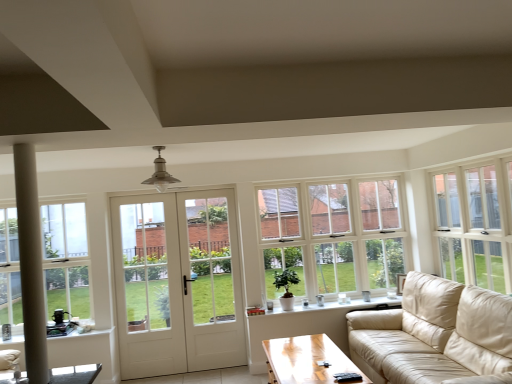
Question: Is beige leather couch at right at the left side of white glass door at center?

Choices:
 (A) yes
 (B) no

Answer: (B)

Question: Considering the relative positions of beige leather couch at right and white glass door at center in the image provided, is beige leather couch at right to the right of white glass door at center from the viewer's perspective?

Choices:
 (A) yes
 (B) no

Answer: (A)

Question: From the image's perspective, is beige leather couch at right under white glass door at center?

Choices:
 (A) no
 (B) yes

Answer: (B)

Question: Can you confirm if beige leather couch at right is taller than white glass door at center?

Choices:
 (A) yes
 (B) no

Answer: (B)

Question: Could white glass door at center be considered to be inside beige leather couch at right?

Choices:
 (A) no
 (B) yes

Answer: (A)

Question: Are beige leather couch at right and white glass door at center making contact?

Choices:
 (A) yes
 (B) no

Answer: (B)

Question: Could you tell me if clear glass window at left, marked as the first window in a left-to-right arrangement, is facing white wooden door at center?

Choices:
 (A) no
 (B) yes

Answer: (A)

Question: Is clear glass window at left, which is the 2th window from front to back, positioned in front of white wooden door at center?

Choices:
 (A) yes
 (B) no

Answer: (A)

Question: Considering the relative sizes of clear glass window at left, which is the 2th window from front to back, and white wooden door at center in the image provided, is clear glass window at left, which is the 2th window from front to back, taller than white wooden door at center?

Choices:
 (A) yes
 (B) no

Answer: (B)

Question: From the image's perspective, is clear glass window at left, which is the 2th window from front to back, over white wooden door at center?

Choices:
 (A) yes
 (B) no

Answer: (A)

Question: Considering the relative sizes of clear glass window at left, marked as the first window in a left-to-right arrangement, and white wooden door at center in the image provided, is clear glass window at left, marked as the first window in a left-to-right arrangement, bigger than white wooden door at center?

Choices:
 (A) no
 (B) yes

Answer: (A)

Question: Could white wooden door at center be considered to be inside clear glass window at left, placed as the third window when sorted from right to left?

Choices:
 (A) yes
 (B) no

Answer: (B)

Question: Considering the relative sizes of white wooden door at center and white glass door at center in the image provided, is white wooden door at center wider than white glass door at center?

Choices:
 (A) yes
 (B) no

Answer: (B)